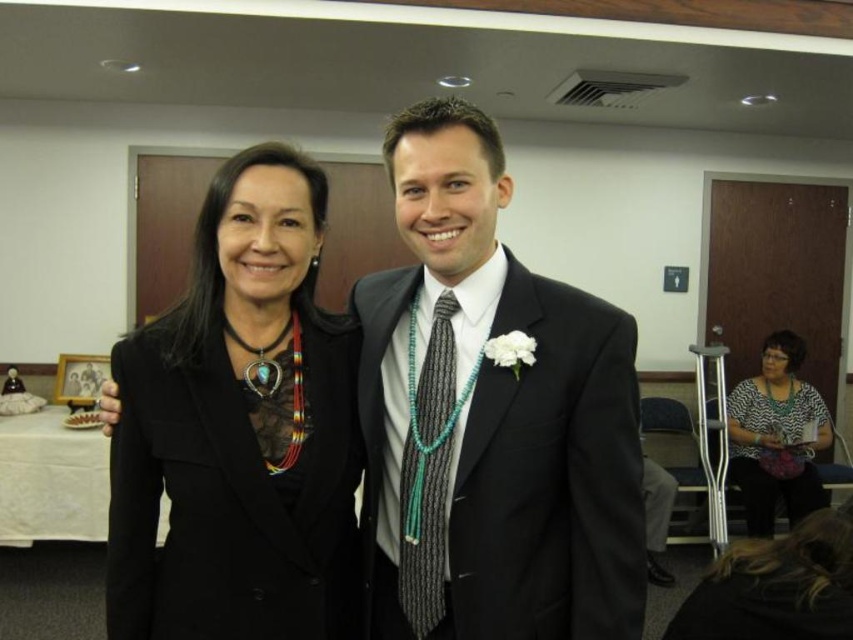
Question: Based on their relative distances, which object is farther from the black leather jacket at left?

Choices:
 (A) printed fabric blouse at lower right
 (B) matte black suit at center

Answer: (A)

Question: Is printed fabric blouse at lower right bigger than gray textured tie at center?

Choices:
 (A) yes
 (B) no

Answer: (A)

Question: Can you confirm if matte black suit at center is positioned above printed fabric blouse at lower right?

Choices:
 (A) no
 (B) yes

Answer: (B)

Question: Among these points, which one is nearest to the camera?

Choices:
 (A) (401, 556)
 (B) (821, 397)
 (C) (177, 417)
 (D) (437, 221)

Answer: (D)

Question: Can you confirm if black leather jacket at left is positioned to the right of gray textured tie at center?

Choices:
 (A) no
 (B) yes

Answer: (A)

Question: Which object appears closest to the camera in this image?

Choices:
 (A) matte black suit at center
 (B) printed fabric blouse at lower right
 (C) gray textured tie at center

Answer: (A)